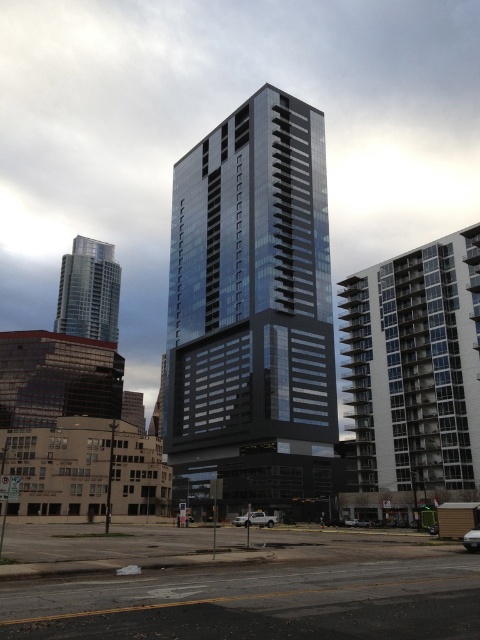
Is the position of shiny silver skyscraper at left more distant than that of white matte car at center?

Yes, it is.

Looking at this image, does shiny silver skyscraper at left have a greater height compared to white matte car at center?

Yes, shiny silver skyscraper at left is taller than white matte car at center.

Which is behind, point (97, 276) or point (432, 531)?

The point (97, 276) is behind.

You are a GUI agent. You are given a task and a screenshot of the screen. Output one action in this format:
    pyautogui.click(x=<x>, y=<y>)
    Task: Click on the shiny silver skyscraper at left
    Image resolution: width=480 pixels, height=640 pixels.
    Given the screenshot: What is the action you would take?
    pyautogui.click(x=88, y=291)

Is the position of glassy metallic building at center more distant than that of silver metallic car at center?

Yes, it is.

Between point (205, 493) and point (471, 529), which one is positioned behind?

The point (205, 493) is more distant.

Is point (310, 186) closer to camera compared to point (478, 529)?

No, it is behind (478, 529).

Locate an element on the screen. Image resolution: width=480 pixels, height=640 pixels. glassy metallic building at center is located at coordinates (252, 310).

Is white matte truck at lower center bigger than white matte car at center?

Yes, white matte truck at lower center is bigger than white matte car at center.

Is white matte truck at lower center shorter than white matte car at center?

No.

Is point (274, 520) behind point (428, 531)?

Yes, point (274, 520) is farther from viewer.

Where is `white matte truck at lower center`? Image resolution: width=480 pixels, height=640 pixels. white matte truck at lower center is located at coordinates (255, 518).